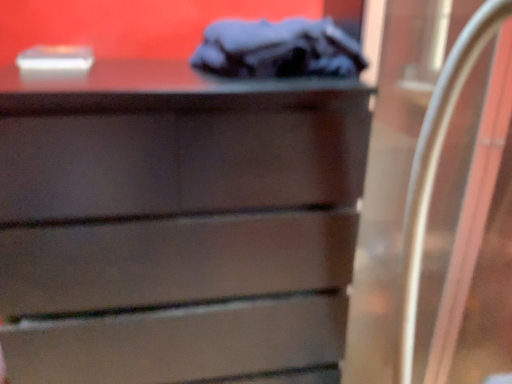
The height and width of the screenshot is (384, 512). What do you see at coordinates (278, 49) in the screenshot?
I see `dark gray fabric at upper center` at bounding box center [278, 49].

Locate an element on the screen. This screenshot has width=512, height=384. matte brown chest of drawers at center is located at coordinates (177, 225).

Image resolution: width=512 pixels, height=384 pixels. What do you see at coordinates (466, 233) in the screenshot?
I see `clear glass door at right` at bounding box center [466, 233].

Identify the location of dark gray fabric at upper center. (278, 49).

The image size is (512, 384). What are the coordinates of `scrub positioned vertically above the matte brown chest of drawers at center (from a real-world perspective)` in the screenshot? It's located at (278, 49).

In the scene shown: Is matte brown chest of drawers at center oriented towards dark gray fabric at upper center?

No, matte brown chest of drawers at center is not oriented towards dark gray fabric at upper center.

Is matte brown chest of drawers at center not inside dark gray fabric at upper center?

Yes, matte brown chest of drawers at center is not within dark gray fabric at upper center.

Considering the positions of objects dark gray fabric at upper center and clear glass door at right in the image provided, who is in front, dark gray fabric at upper center or clear glass door at right?

clear glass door at right is closer to the camera.

Does point (215, 47) come farther from viewer compared to point (400, 168)?

No, (215, 47) is in front of (400, 168).

Locate an element on the screen. This screenshot has width=512, height=384. glass door that appears below the dark gray fabric at upper center (from the image's perspective) is located at coordinates (466, 233).

Considering the sizes of objects dark gray fabric at upper center and clear glass door at right in the image provided, who is smaller, dark gray fabric at upper center or clear glass door at right?

dark gray fabric at upper center is smaller.

From a real-world perspective, who is located lower, clear glass door at right or dark gray fabric at upper center?

clear glass door at right.

Is clear glass door at right smaller than dark gray fabric at upper center?

Actually, clear glass door at right might be larger than dark gray fabric at upper center.

Does clear glass door at right have a greater width compared to dark gray fabric at upper center?

Indeed, clear glass door at right has a greater width compared to dark gray fabric at upper center.

Does clear glass door at right turn towards dark gray fabric at upper center?

No, clear glass door at right is not oriented towards dark gray fabric at upper center.

How many degrees apart are the facing directions of matte brown chest of drawers at center and clear glass door at right?

There is a 1.21-degree angle between the facing directions of matte brown chest of drawers at center and clear glass door at right.

From a real-world perspective, which object rests below the other?

matte brown chest of drawers at center, from a real-world perspective.

Could you tell me if matte brown chest of drawers at center is facing clear glass door at right?

No, matte brown chest of drawers at center is not aimed at clear glass door at right.

Locate an element on the screen. The width and height of the screenshot is (512, 384). chest of drawers below the dark gray fabric at upper center (from a real-world perspective) is located at coordinates (177, 225).

From the image's perspective, is dark gray fabric at upper center above or below matte brown chest of drawers at center?

dark gray fabric at upper center is situated higher than matte brown chest of drawers at center in the image.

Does dark gray fabric at upper center appear on the right side of matte brown chest of drawers at center?

Yes, dark gray fabric at upper center is to the right of matte brown chest of drawers at center.

Does point (430, 215) come closer to viewer compared to point (184, 85)?

That is False.

Are clear glass door at right and matte brown chest of drawers at center making contact?

No, clear glass door at right is not beside matte brown chest of drawers at center.

At what (x,y) coordinates should I click in order to perform the action: click on glass door lying in front of the matte brown chest of drawers at center. Please return your answer as a coordinate pair (x, y). The image size is (512, 384). Looking at the image, I should click on (466, 233).

You are a GUI agent. You are given a task and a screenshot of the screen. Output one action in this format:
    pyautogui.click(x=<x>, y=<y>)
    Task: Click on the scrub located above the matte brown chest of drawers at center (from the image's perspective)
    Image resolution: width=512 pixels, height=384 pixels.
    Given the screenshot: What is the action you would take?
    pyautogui.click(x=278, y=49)

This screenshot has height=384, width=512. In order to click on scrub lying behind the clear glass door at right in this screenshot , I will do `click(278, 49)`.

Which object lies further to the anchor point dark gray fabric at upper center, clear glass door at right or matte brown chest of drawers at center?

clear glass door at right is positioned further to the anchor dark gray fabric at upper center.

When comparing their distances from clear glass door at right, does dark gray fabric at upper center or matte brown chest of drawers at center seem closer?

Among the two, dark gray fabric at upper center is located nearer to clear glass door at right.

Estimate the real-world distances between objects in this image. Which object is further from clear glass door at right, matte brown chest of drawers at center or dark gray fabric at upper center?

Among the two, matte brown chest of drawers at center is located further to clear glass door at right.

Considering their positions, is dark gray fabric at upper center positioned further to matte brown chest of drawers at center than clear glass door at right?

clear glass door at right.

Looking at the image, which one is located closer to matte brown chest of drawers at center, clear glass door at right or dark gray fabric at upper center?

dark gray fabric at upper center lies closer to matte brown chest of drawers at center than the other object.

Looking at the image, which one is located further to dark gray fabric at upper center, matte brown chest of drawers at center or clear glass door at right?

Based on the image, clear glass door at right appears to be further to dark gray fabric at upper center.

Where is `glass door between dark gray fabric at upper center and matte brown chest of drawers at center in the vertical direction`? Image resolution: width=512 pixels, height=384 pixels. glass door between dark gray fabric at upper center and matte brown chest of drawers at center in the vertical direction is located at coordinates (466, 233).